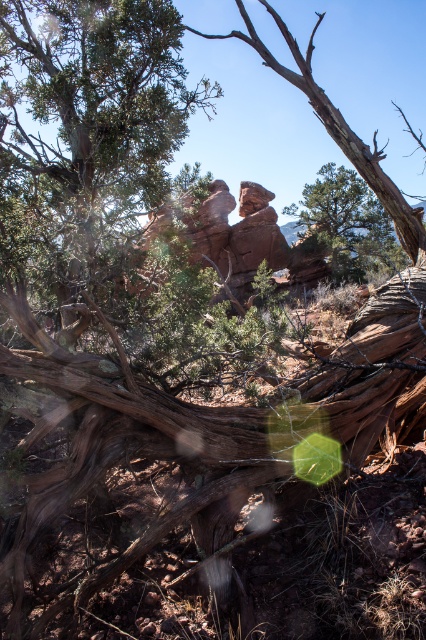
Who is more forward, [192,262] or [354,275]?

Point [192,262]

Is rustic stone rock formation at center above green matte tree at center?

Actually, rustic stone rock formation at center is below green matte tree at center.

Which is behind, point (192, 198) or point (324, 202)?

The point (324, 202) is behind.

The image size is (426, 640). In order to click on rustic stone rock formation at center in this screenshot , I will do `click(224, 234)`.